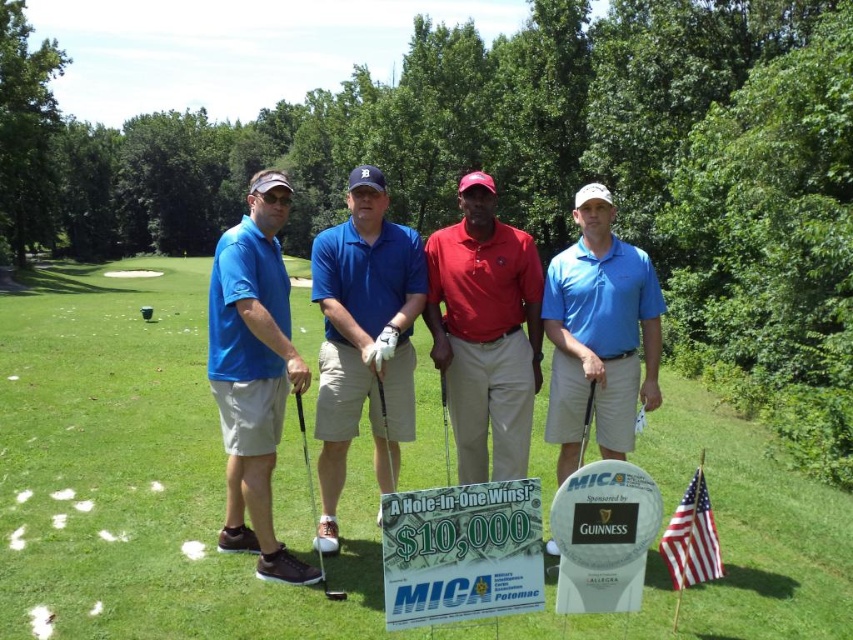
Looking at this image, which is below, green grass at center or american flag at lower right?

american flag at lower right

Does green grass at center have a lesser width compared to american flag at lower right?

In fact, green grass at center might be wider than american flag at lower right.

Who is more distant from viewer, (250, 593) or (697, 496)?

The point (250, 593) is behind.

Where is `green grass at center`? green grass at center is located at coordinates (141, 476).

Is american flag at lower right positioned at the back of matte black golf club at center?

No, american flag at lower right is closer to the viewer.

Based on the photo, is american flag at lower right thinner than matte black golf club at center?

No, american flag at lower right is not thinner than matte black golf club at center.

The image size is (853, 640). I want to click on american flag at lower right, so click(x=692, y=538).

Is blue cotton polo shirt at center behind glossy wood golf club at center?

No.

Who is positioned more to the left, blue cotton polo shirt at center or glossy wood golf club at center?

From the viewer's perspective, blue cotton polo shirt at center appears more on the left side.

Measure the distance between blue cotton polo shirt at center and camera.

blue cotton polo shirt at center and camera are 4.62 meters apart from each other.

You are a GUI agent. You are given a task and a screenshot of the screen. Output one action in this format:
    pyautogui.click(x=<x>, y=<y>)
    Task: Click on the blue cotton polo shirt at center
    The height and width of the screenshot is (640, 853).
    Given the screenshot: What is the action you would take?
    pyautogui.click(x=364, y=337)